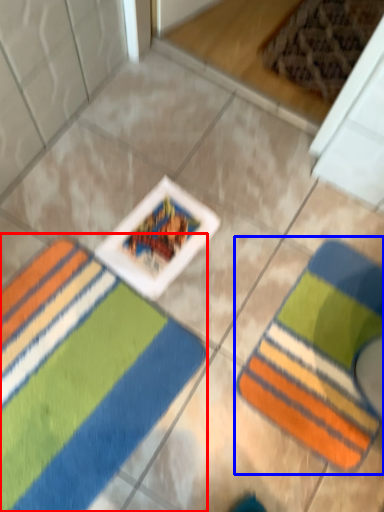
Question: Which of the following is the closest to the observer, towel (highlighted by a red box) or towel (highlighted by a blue box)?

Choices:
 (A) towel
 (B) towel

Answer: (A)